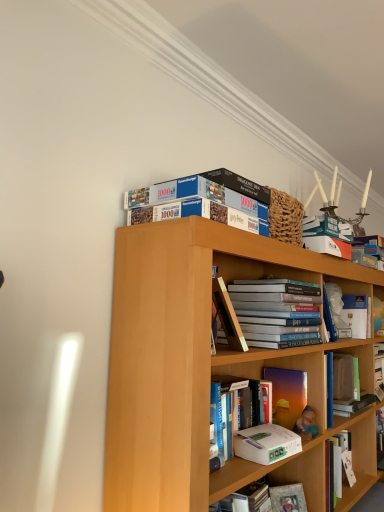
Question: Is white matte paperback book at center, which ranks as the second paperback book in bottom-to-top order, thinner than matte purple book at center, which appears as the second book when viewed from the right?

Choices:
 (A) no
 (B) yes

Answer: (B)

Question: Is white matte paperback book at center, which ranks as the second paperback book in bottom-to-top order, completely or partially outside of matte purple book at center, which is counted as the fifth book, starting from the left?

Choices:
 (A) no
 (B) yes

Answer: (B)

Question: Is white matte paperback book at center, which ranks as the second paperback book in bottom-to-top order, wider than matte purple book at center, which is counted as the fifth book, starting from the left?

Choices:
 (A) no
 (B) yes

Answer: (A)

Question: From the image's perspective, does white matte paperback book at center, which ranks as the second paperback book in bottom-to-top order, appear higher than matte purple book at center, which is counted as the fifth book, starting from the left?

Choices:
 (A) no
 (B) yes

Answer: (A)

Question: Is white matte paperback book at center, the first paperback book positioned from the top, shorter than matte purple book at center, which appears as the second book when viewed from the right?

Choices:
 (A) yes
 (B) no

Answer: (A)

Question: From the image's perspective, is hardcover book at lower center, acting as the first paperback book starting from the bottom, above or below hardcover books at center, arranged as the 3th book when viewed from the right?

Choices:
 (A) above
 (B) below

Answer: (B)

Question: In the image, is hardcover book at lower center, arranged as the second paperback book when viewed from the front, on the left side or the right side of hardcover books at center, positioned as the fourth book in left-to-right order?

Choices:
 (A) left
 (B) right

Answer: (B)

Question: Is hardcover book at lower center, arranged as the second paperback book when viewed from the front, spatially inside hardcover books at center, positioned as the fourth book in left-to-right order, or outside of it?

Choices:
 (A) inside
 (B) outside

Answer: (B)

Question: Is hardcover book at lower center, arranged as the second paperback book when viewed from the front, in front of or behind hardcover books at center, arranged as the 3th book when viewed from the right, in the image?

Choices:
 (A) front
 (B) behind

Answer: (B)

Question: Does point (271, 334) appear closer or farther from the camera than point (276, 368)?

Choices:
 (A) farther
 (B) closer

Answer: (B)

Question: Considering the positions of hardcover books at center, positioned as the fourth book in left-to-right order, and matte purple book at center, which is counted as the fifth book, starting from the left, in the image, is hardcover books at center, positioned as the fourth book in left-to-right order, wider or thinner than matte purple book at center, which is counted as the fifth book, starting from the left,?

Choices:
 (A) wide
 (B) thin

Answer: (A)

Question: From a real-world perspective, relative to matte purple book at center, which appears as the second book when viewed from the right, is hardcover books at center, positioned as the fourth book in left-to-right order, vertically above or below?

Choices:
 (A) above
 (B) below

Answer: (A)

Question: Is hardcover books at center, positioned as the fourth book in left-to-right order, bigger or smaller than matte purple book at center, which appears as the second book when viewed from the right?

Choices:
 (A) small
 (B) big

Answer: (B)

Question: Looking at the image, does white matte book at center-right, which appears as the first book when viewed from the right, seem bigger or smaller compared to white matte paperback book at center, the 1th paperback book viewed from the front?

Choices:
 (A) small
 (B) big

Answer: (B)

Question: Considering the relative positions of white matte book at center-right, marked as the 6th book in a left-to-right arrangement, and white matte paperback book at center, the 1th paperback book viewed from the front, in the image provided, is white matte book at center-right, marked as the 6th book in a left-to-right arrangement, to the left or to the right of white matte paperback book at center, the 1th paperback book viewed from the front,?

Choices:
 (A) left
 (B) right

Answer: (B)